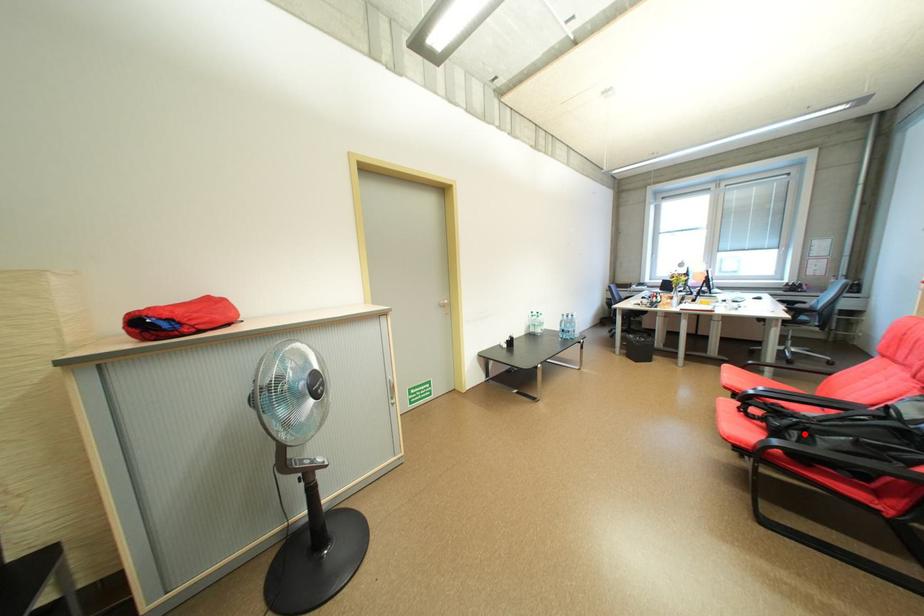
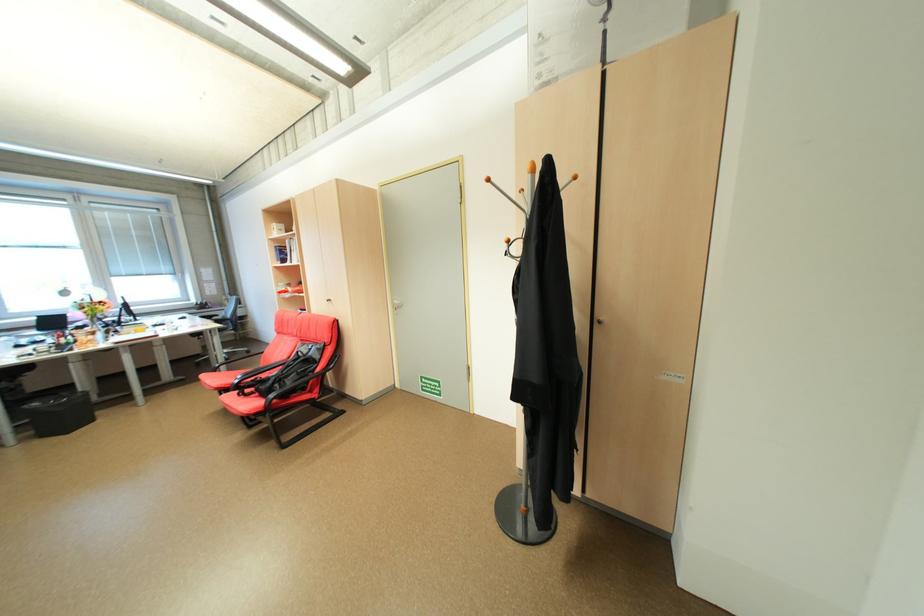
The point at the highlighted location is marked in the first image. Where is the corresponding point in the second image?

(286, 386)